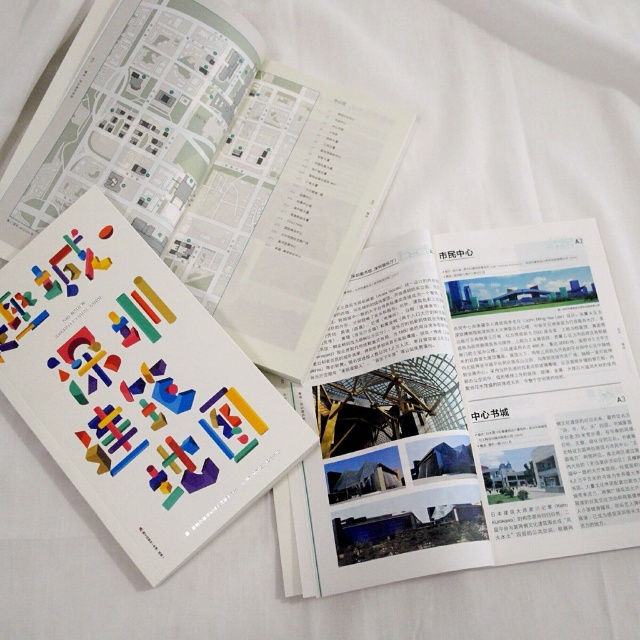
Between white paper at upper center and colorful paper cutouts at center, which one appears on the right side from the viewer's perspective?

From the viewer's perspective, white paper at upper center appears more on the right side.

Between point (573, 324) and point (99, 198), which one is positioned behind?

The point (99, 198) is more distant.

Where is `white paper at upper center`? The width and height of the screenshot is (640, 640). white paper at upper center is located at coordinates (467, 412).

This screenshot has height=640, width=640. I want to click on white paper at upper center, so click(x=467, y=412).

Can you confirm if multicolored plastic book at center is positioned above colorful paper cutouts at center?

Correct, multicolored plastic book at center is located above colorful paper cutouts at center.

You are a GUI agent. You are given a task and a screenshot of the screen. Output one action in this format:
    pyautogui.click(x=<x>, y=<y>)
    Task: Click on the multicolored plastic book at center
    
    Given the screenshot: What is the action you would take?
    pyautogui.click(x=212, y=168)

Which is behind, point (368, 202) or point (188, 458)?

Positioned behind is point (368, 202).

Locate an element on the screen. multicolored plastic book at center is located at coordinates (212, 168).

Is white paper at upper center above multicolored plastic book at center?

No.

Is point (596, 284) in front of point (256, 170)?

Yes, point (596, 284) is in front of point (256, 170).

You are a GUI agent. You are given a task and a screenshot of the screen. Output one action in this format:
    pyautogui.click(x=<x>, y=<y>)
    Task: Click on the white paper at upper center
    
    Given the screenshot: What is the action you would take?
    pyautogui.click(x=467, y=412)